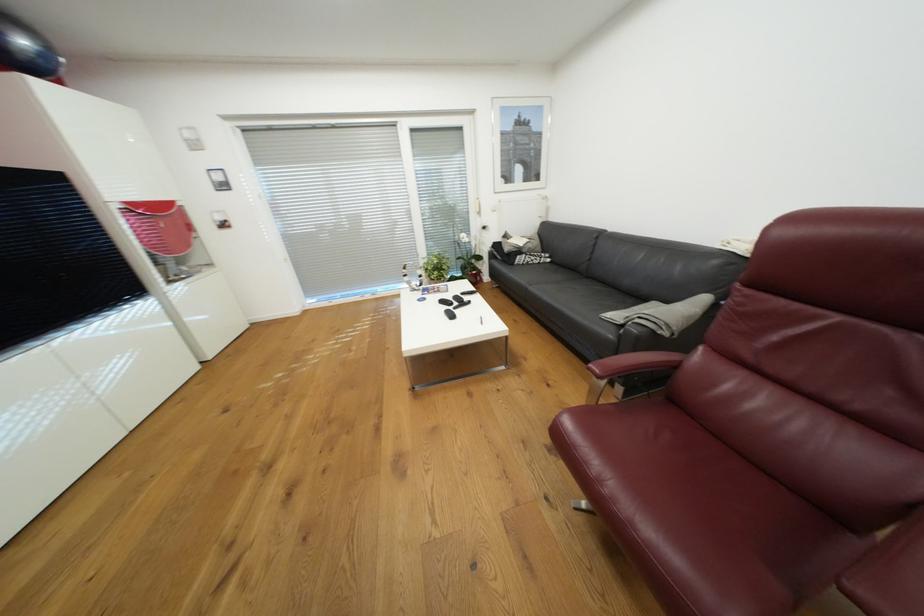
What do you see at coordinates (564, 286) in the screenshot? I see `the sofa sitting surface` at bounding box center [564, 286].